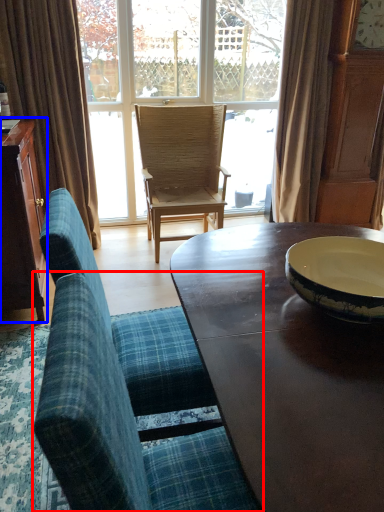
Question: Among these objects, which one is nearest to the camera, chair (highlighted by a red box) or cabinetry (highlighted by a blue box)?

Choices:
 (A) chair
 (B) cabinetry

Answer: (A)